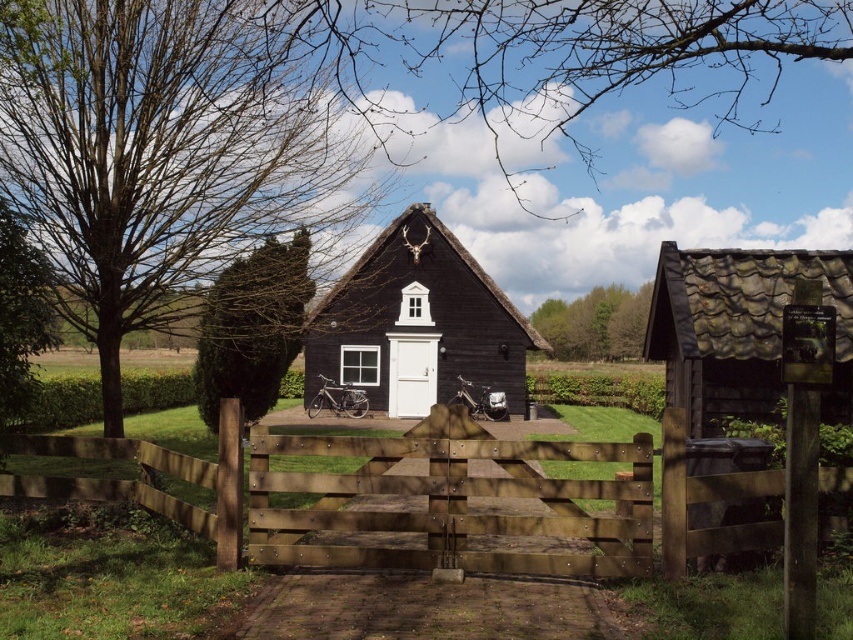
Which is more to the right, matte black cottage at center or green leafy bush at center?

From the viewer's perspective, matte black cottage at center appears more on the right side.

Can you confirm if matte black cottage at center is positioned to the right of green leafy bush at center?

Indeed, matte black cottage at center is positioned on the right side of green leafy bush at center.

Is point (311, 371) positioned before point (254, 317)?

No, (311, 371) is behind (254, 317).

Image resolution: width=853 pixels, height=640 pixels. Identify the location of matte black cottage at center. (416, 323).

Who is positioned more to the right, green leafy tree at center or green leafy trees at center?

From the viewer's perspective, green leafy trees at center appears more on the right side.

Does green leafy tree at center appear on the right side of green leafy trees at center?

Incorrect, green leafy tree at center is not on the right side of green leafy trees at center.

Between point (218, 120) and point (611, 332), which one is positioned behind?

Point (611, 332)

Where is `green leafy tree at center`? The image size is (853, 640). green leafy tree at center is located at coordinates (169, 148).

Is brown wooden gate at center positioned behind green leafy trees at center?

No, brown wooden gate at center is in front of green leafy trees at center.

Which is more to the right, brown wooden gate at center or green leafy trees at center?

Positioned to the right is green leafy trees at center.

This screenshot has width=853, height=640. Identify the location of brown wooden gate at center. (495, 496).

Identify the location of brown wooden gate at center. (495, 496).